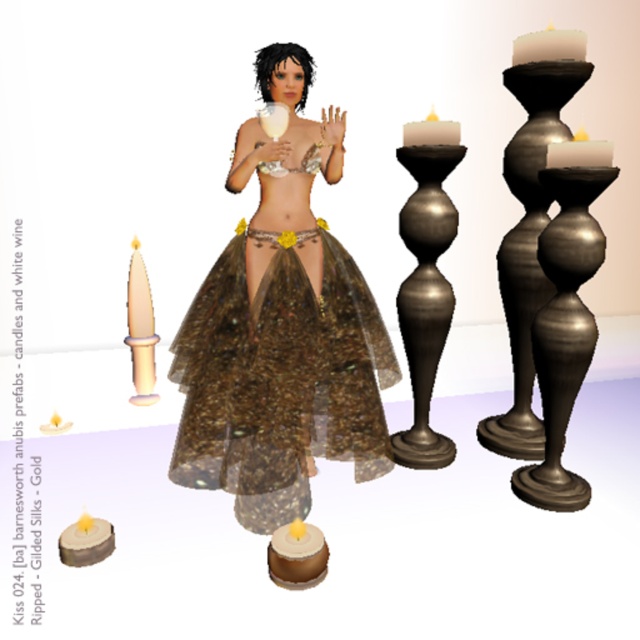
Between point (285, 509) and point (564, 44), which one is positioned behind?

Positioned behind is point (564, 44).

Measure the distance from ripped gilded silks at center to white matte candle at upper right.

The distance of ripped gilded silks at center from white matte candle at upper right is 4.01 feet.

The image size is (640, 640). What do you see at coordinates (280, 376) in the screenshot? I see `ripped gilded silks at center` at bounding box center [280, 376].

This screenshot has height=640, width=640. What are the coordinates of `ripped gilded silks at center` in the screenshot? It's located at (280, 376).

Which is more to the right, brown matte cake at lower center or matte black candle at upper right?

matte black candle at upper right is more to the right.

Is point (291, 550) farther from viewer compared to point (552, 145)?

No, (291, 550) is closer to viewer.

At what (x,y) coordinates should I click in order to perform the action: click on brown matte cake at lower center. Please return your answer as a coordinate pair (x, y). This screenshot has width=640, height=640. Looking at the image, I should click on (296, 556).

Between matte gold candlestick at lower left and brown matte cake at lower center, which one has more height?

matte gold candlestick at lower left is taller.

Between matte gold candlestick at lower left and brown matte cake at lower center, which one appears on the right side from the viewer's perspective?

brown matte cake at lower center is more to the right.

Between point (136, 292) and point (275, 577), which one is positioned behind?

The point (136, 292) is more distant.

You are a GUI agent. You are given a task and a screenshot of the screen. Output one action in this format:
    pyautogui.click(x=<x>, y=<y>)
    Task: Click on the matte gold candlestick at lower left
    
    Given the screenshot: What is the action you would take?
    pyautogui.click(x=140, y=330)